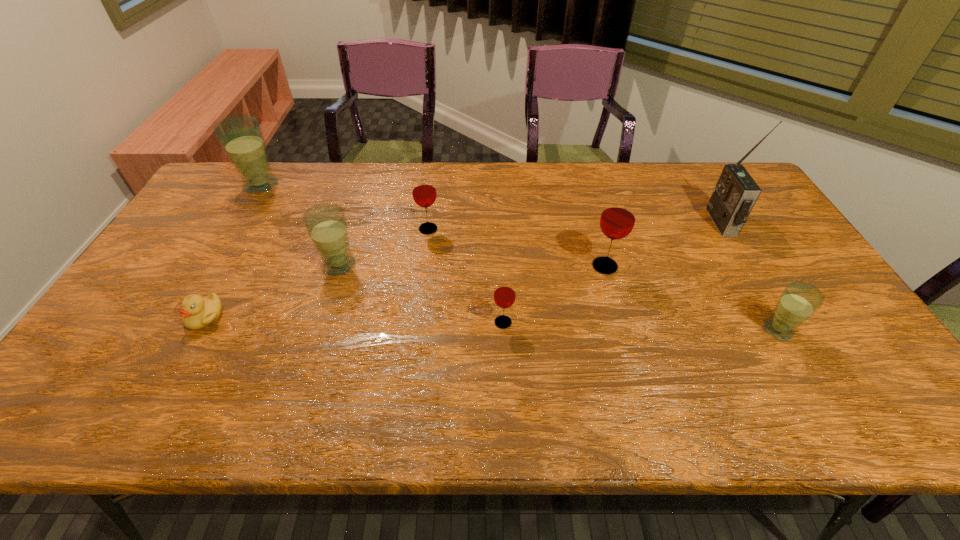
The height and width of the screenshot is (540, 960). Find the location of `the rightmost blue glass`. the rightmost blue glass is located at coordinates (799, 300).

The height and width of the screenshot is (540, 960). I want to click on the fourth glass from left to right, so click(504, 296).

The height and width of the screenshot is (540, 960). Identify the location of the nearest red glass. tap(504, 296).

The width and height of the screenshot is (960, 540). What are the coordinates of `duckling` in the screenshot? It's located at (197, 312).

The height and width of the screenshot is (540, 960). I want to click on the shortest object, so [197, 312].

Locate an element on the screen. The image size is (960, 540). free space located on the display of the radio receiver is located at coordinates (694, 222).

I want to click on vacant space situated 0.230m on the display of the radio receiver, so click(639, 222).

Identify the location of free space located 0.380m on the display of the radio receiver. (591, 222).

The image size is (960, 540). I want to click on vacant area situated on the front of the sixth object from left to right, so coord(615,302).

Where is `free space located 0.210m on the right of the farthest object`? This screenshot has width=960, height=540. free space located 0.210m on the right of the farthest object is located at coordinates (342, 186).